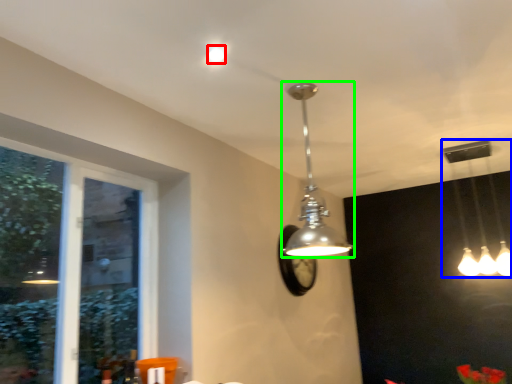
Question: Considering the real-world distances, which object is farthest from droplight (highlighted by a red box)? lamp (highlighted by a blue box) or lamp (highlighted by a green box)?

Choices:
 (A) lamp
 (B) lamp

Answer: (A)